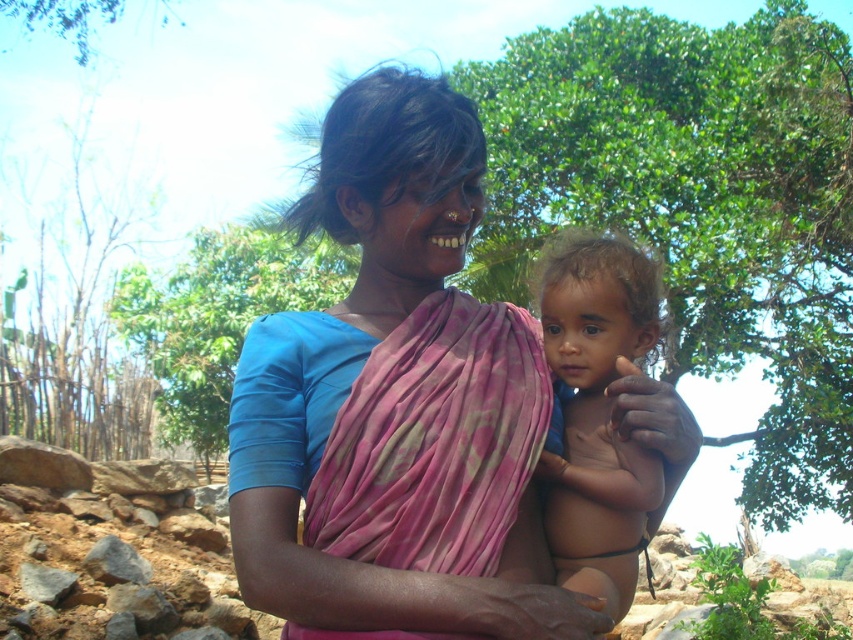
Question: Which of these objects is positioned farthest from the green leafy tree at center?

Choices:
 (A) green leafy tree at upper left
 (B) pink fabric at center

Answer: (B)

Question: Is pink fabric at center closer to the viewer compared to green leafy tree at center?

Choices:
 (A) no
 (B) yes

Answer: (B)

Question: Among these points, which one is farthest from the camera?

Choices:
 (A) (554, 600)
 (B) (113, 10)
 (C) (593, 524)
 (D) (235, 305)

Answer: (D)

Question: Which of the following is the farthest from the observer?

Choices:
 (A) green leafy tree at upper left
 (B) smooth skin baby at center
 (C) green leafy tree at center

Answer: (C)

Question: Is pink fabric at center bigger than green leafy tree at center?

Choices:
 (A) no
 (B) yes

Answer: (A)

Question: Can you confirm if smooth skin baby at center is positioned above green leafy tree at center?

Choices:
 (A) yes
 (B) no

Answer: (B)